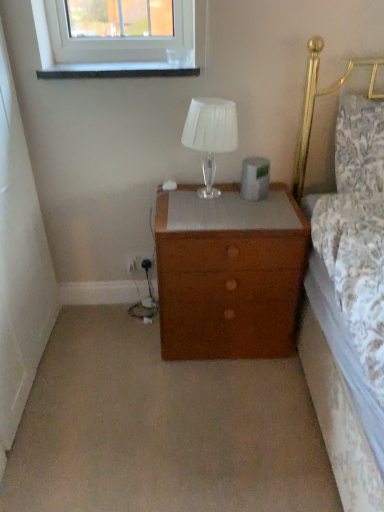
Identify the location of vacant area on top of wooden nightstand at center (from a real-world perspective). (208, 198).